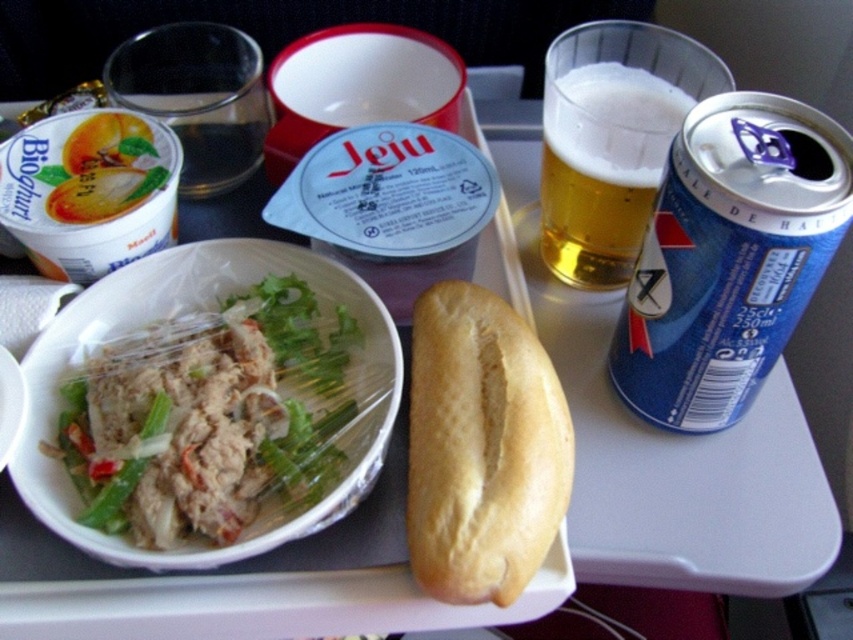
Which is in front, point (842, 205) or point (645, 77)?

Point (842, 205) is in front.

Which of these two, blue matte yogurt at upper left or golden lager glass at upper right, stands taller?

With more height is blue matte yogurt at upper left.

What do you see at coordinates (729, 257) in the screenshot? I see `blue matte yogurt at upper left` at bounding box center [729, 257].

Locate an element on the screen. blue matte yogurt at upper left is located at coordinates (729, 257).

Is white plastic bowl at center-left to the right of blue matte yogurt at upper left from the viewer's perspective?

Incorrect, white plastic bowl at center-left is not on the right side of blue matte yogurt at upper left.

Between white plastic bowl at center-left and blue matte yogurt at upper left, which one has more height?

Standing taller between the two is blue matte yogurt at upper left.

Find the location of `white plastic bowl at center-left`. white plastic bowl at center-left is located at coordinates 212,417.

Does white plastic bowl at center-left lie in front of golden lager glass at upper right?

That is True.

Locate an element on the screen. Image resolution: width=853 pixels, height=640 pixels. white plastic bowl at center-left is located at coordinates (212, 417).